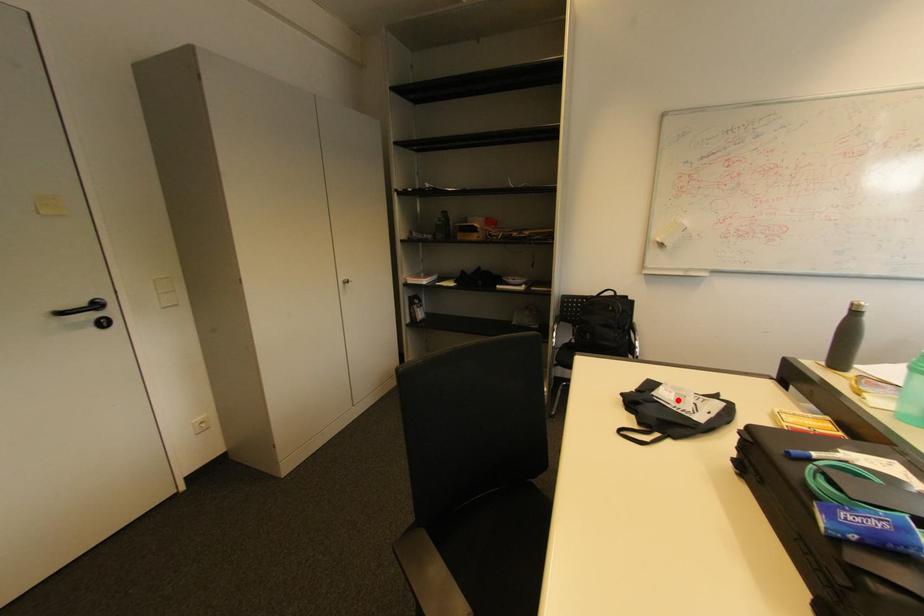
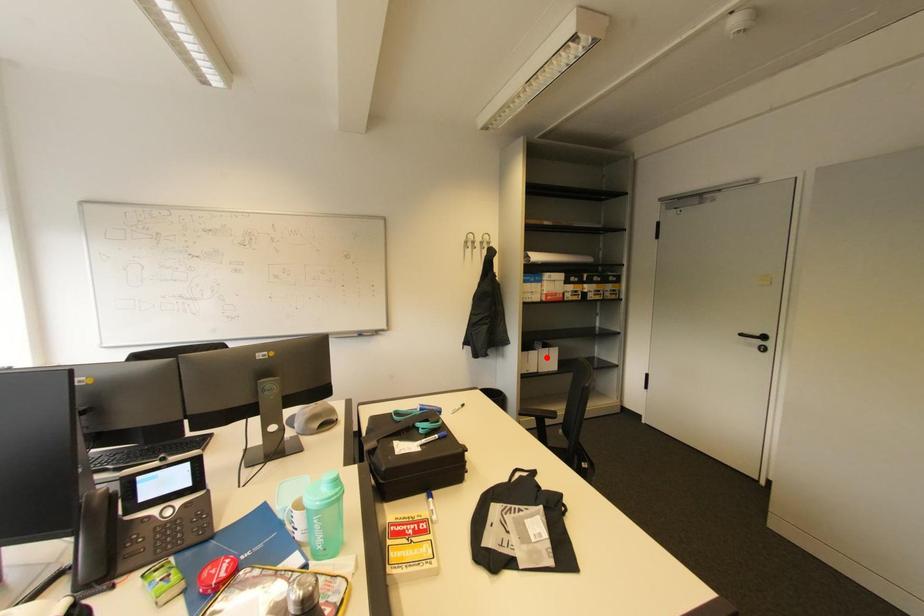
I am providing you with two images of the same scene from different viewpoints. A red point is marked on the first image and another point is marked on the second image. Does the point marked in image1 correspond to the same location as the one in image2?

No